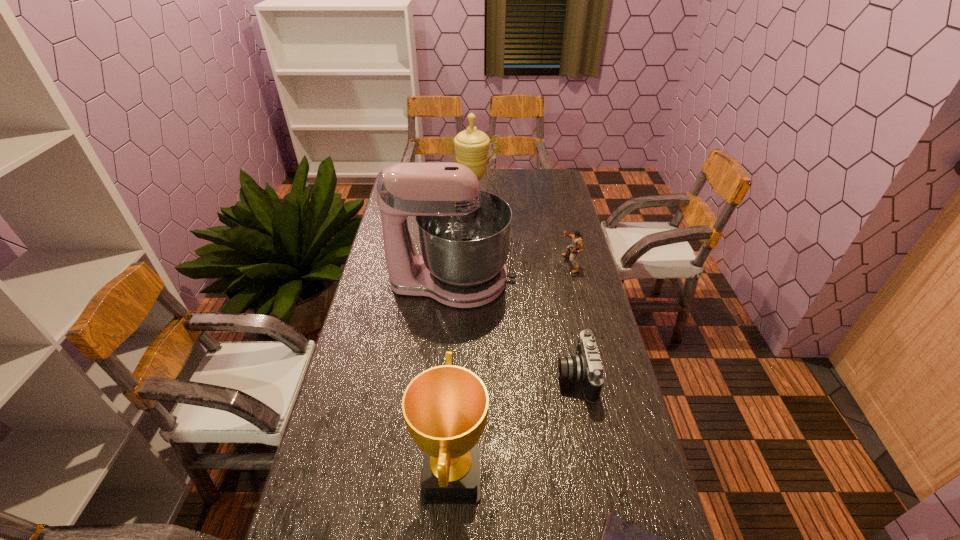
You are a GUI agent. You are given a task and a screenshot of the screen. Output one action in this format:
    pyautogui.click(x=<x>, y=<y>)
    Task: Click on the farthest object
    Image resolution: width=960 pixels, height=540 pixels.
    Given the screenshot: What is the action you would take?
    pyautogui.click(x=471, y=146)

You are a GUI agent. You are given a task and a screenshot of the screen. Output one action in this format:
    pyautogui.click(x=<x>, y=<y>)
    Task: Click on the mixer
    The height and width of the screenshot is (540, 960).
    Given the screenshot: What is the action you would take?
    pyautogui.click(x=464, y=232)

Identify the location of the fourth shortest object. (445, 408).

This screenshot has height=540, width=960. I want to click on the third shortest object, so click(x=577, y=246).

The height and width of the screenshot is (540, 960). Find the location of `the fifth tallest object`. the fifth tallest object is located at coordinates (585, 367).

In order to click on the fourth farthest object in this screenshot , I will do `click(585, 367)`.

At what (x,y) coordinates should I click in order to perform the action: click on vacant region located at the front of the trophy cup with handles. Please return your answer as a coordinate pair (x, y). The width and height of the screenshot is (960, 540). Looking at the image, I should click on (471, 290).

This screenshot has width=960, height=540. I want to click on free space located 0.260m on the front-facing side of the mixer, so click(587, 281).

You are a GUI agent. You are given a task and a screenshot of the screen. Output one action in this format:
    pyautogui.click(x=<x>, y=<y>)
    Task: Click on the blank area located 0.230m on the front-facing side of the award
    
    Given the screenshot: What is the action you would take?
    pyautogui.click(x=582, y=474)

Locate an element on the screen. Image resolution: width=960 pixels, height=540 pixels. vacant space situated 0.100m on the front-facing side of the third shortest object is located at coordinates (536, 264).